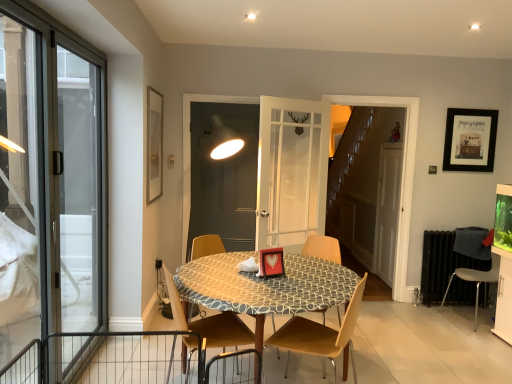
Question: Does wooden chair at center, which is counted as the 3th chair, starting from the left, appear on the left side of matte gold picture frame at upper left, which appears as the first picture frame when viewed from the front?

Choices:
 (A) yes
 (B) no

Answer: (B)

Question: Is wooden chair at center, which is counted as the 3th chair, starting from the left, directly adjacent to matte gold picture frame at upper left, positioned as the second picture frame in back-to-front order?

Choices:
 (A) yes
 (B) no

Answer: (B)

Question: Is wooden chair at center, which is counted as the 3th chair, starting from the left, looking in the opposite direction of matte gold picture frame at upper left, positioned as the second picture frame in back-to-front order?

Choices:
 (A) no
 (B) yes

Answer: (A)

Question: Is wooden chair at center, which is counted as the 3th chair, starting from the left, facing towards matte gold picture frame at upper left, which appears as the second picture frame when viewed from the right?

Choices:
 (A) no
 (B) yes

Answer: (A)

Question: From a real-world perspective, is wooden chair at center, the 2th chair viewed from the right, on matte gold picture frame at upper left, which appears as the second picture frame when viewed from the right?

Choices:
 (A) yes
 (B) no

Answer: (B)

Question: Is wooden chair at center, which is counted as the 3th chair, starting from the left, to the right of matte gold picture frame at upper left, which appears as the second picture frame when viewed from the right, from the viewer's perspective?

Choices:
 (A) no
 (B) yes

Answer: (B)

Question: Considering the relative sizes of wooden chair at center, the 1th chair in the left-to-right sequence, and patterned fabric table at center in the image provided, is wooden chair at center, the 1th chair in the left-to-right sequence, shorter than patterned fabric table at center?

Choices:
 (A) yes
 (B) no

Answer: (B)

Question: Is the depth of wooden chair at center, the 1th chair in the left-to-right sequence, greater than that of patterned fabric table at center?

Choices:
 (A) yes
 (B) no

Answer: (B)

Question: Is wooden chair at center, the 1th chair in the left-to-right sequence, to the left of patterned fabric table at center from the viewer's perspective?

Choices:
 (A) yes
 (B) no

Answer: (A)

Question: Does wooden chair at center, acting as the 4th chair starting from the right, have a greater height compared to patterned fabric table at center?

Choices:
 (A) yes
 (B) no

Answer: (A)

Question: Is wooden chair at center, acting as the 4th chair starting from the right, outside patterned fabric table at center?

Choices:
 (A) no
 (B) yes

Answer: (A)

Question: Is patterned fabric table at center a part of wooden chair at center, acting as the 4th chair starting from the right?

Choices:
 (A) no
 (B) yes

Answer: (A)

Question: Can you confirm if matte gold picture frame at upper left, arranged as the first picture frame when viewed from the left, is positioned to the left of transparent glass door at left?

Choices:
 (A) yes
 (B) no

Answer: (B)